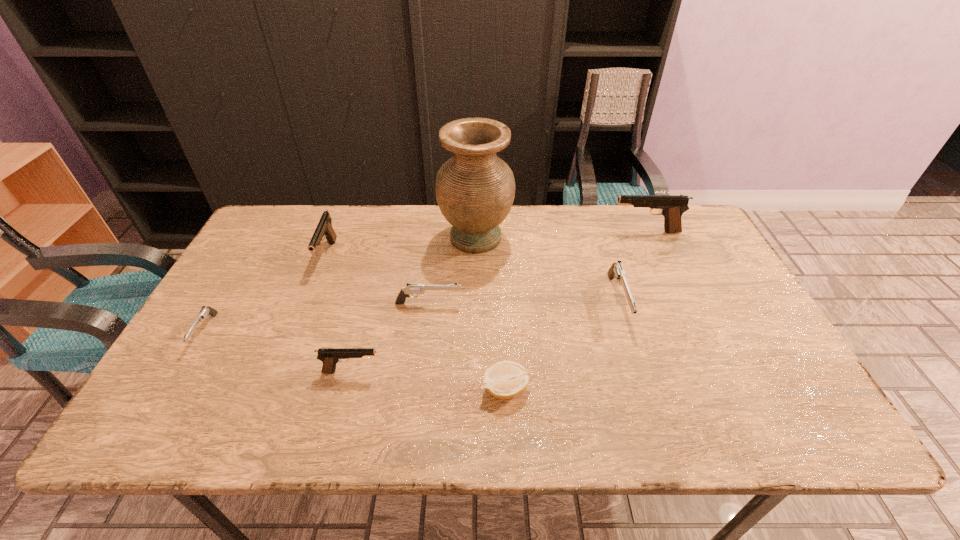
The height and width of the screenshot is (540, 960). I want to click on blank space at the far edge, so click(x=355, y=211).

In the image, there is a desktop. At what (x,y) coordinates should I click in order to perform the action: click on vacant space at the near edge. Please return your answer as a coordinate pair (x, y). This screenshot has width=960, height=540. Looking at the image, I should click on (363, 422).

Where is `blank space at the left edge of the desktop`? The width and height of the screenshot is (960, 540). blank space at the left edge of the desktop is located at coordinates (196, 354).

In the image, there is a desktop. At what (x,y) coordinates should I click in order to perform the action: click on free region at the right edge. Please return your answer as a coordinate pair (x, y). This screenshot has height=540, width=960. Looking at the image, I should click on (681, 291).

In order to click on vacant region at the far left corner of the desktop in this screenshot , I will do [300, 228].

Locate an element on the screen. blank space at the near right corner of the desktop is located at coordinates (768, 431).

Where is `free spot between the second tallest pistol and the tallest object`? free spot between the second tallest pistol and the tallest object is located at coordinates (401, 246).

Where is `free point between the yellow lemon and the second silver pistol from right to left`? free point between the yellow lemon and the second silver pistol from right to left is located at coordinates (468, 346).

Identify the location of free space between the biggest silver pistol and the yellow lemon. The width and height of the screenshot is (960, 540). (562, 345).

Find the location of `free space between the tallest object and the nearest pistol`. free space between the tallest object and the nearest pistol is located at coordinates (414, 305).